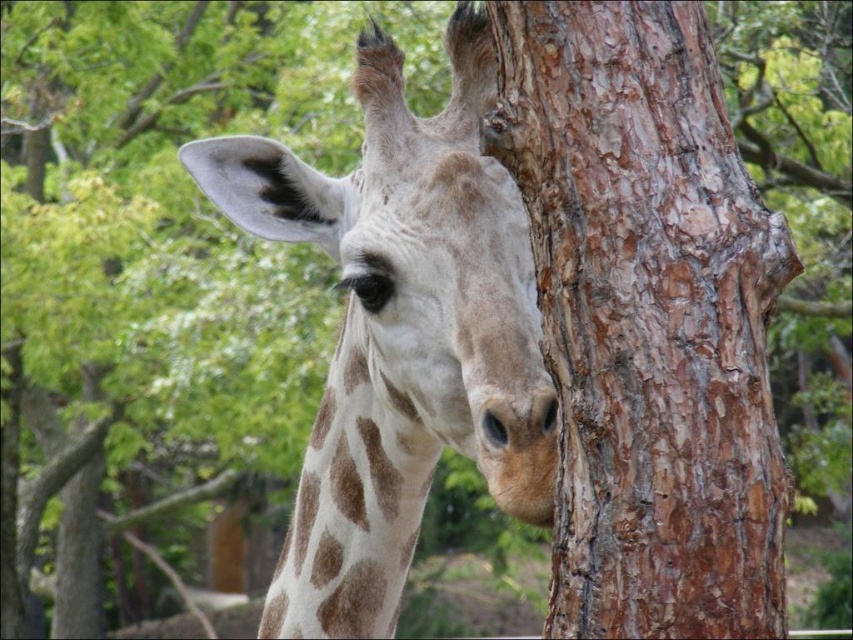
You are observing a giraffe near a tree. There are two points marked in the image. The first point is at coordinate point (581, 202) and the second point is at coordinate point (350, 477). Which point is closer to you, the observer?

Point (581, 202) is in front of point (350, 477), so the first point is closer to you.